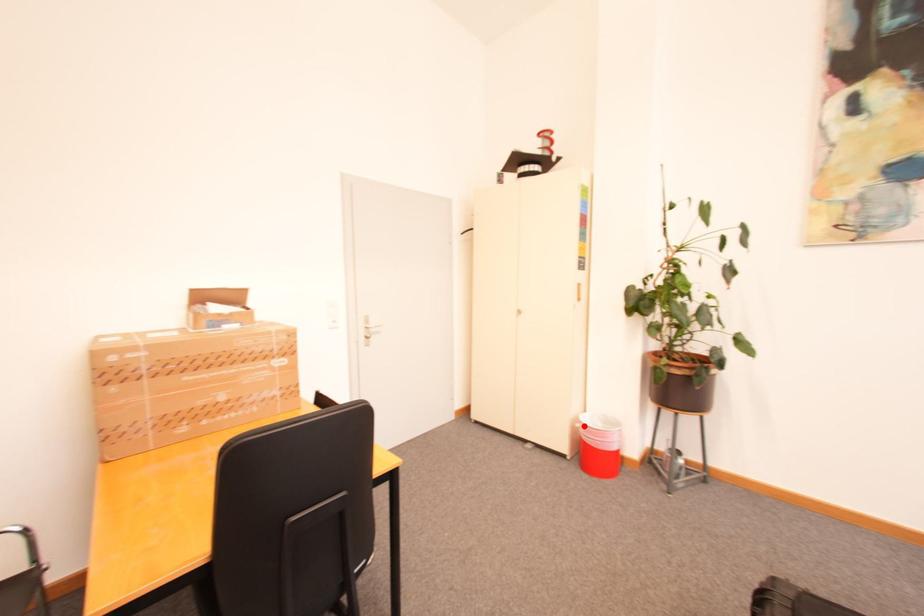
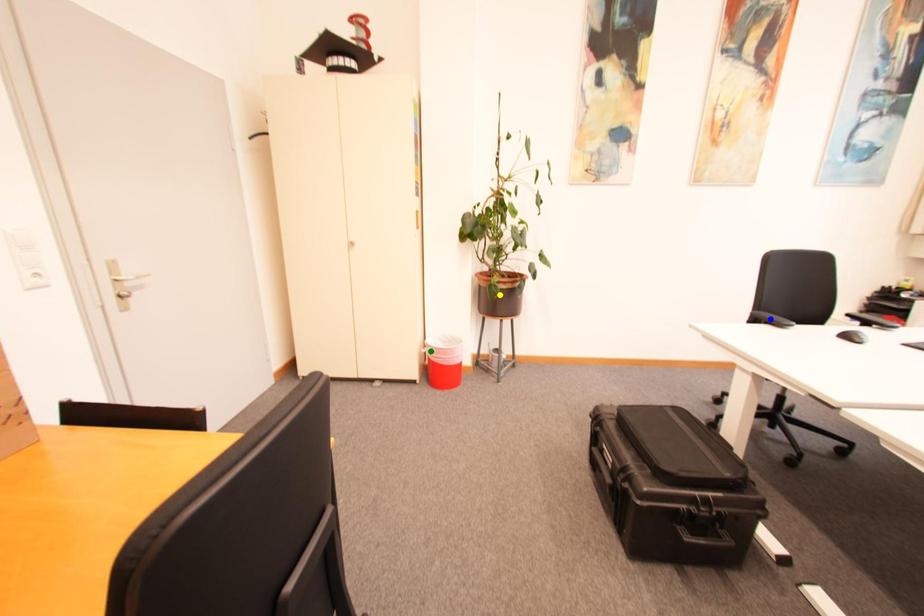
Question: I am providing you with two images of the same scene from different viewpoints. A red point is marked on the first image. You are given multiple points on the second image. Which mark in image 2 goes with the point in image 1?

Choices:
 (A) yellow point
 (B) green point
 (C) blue point

Answer: (B)